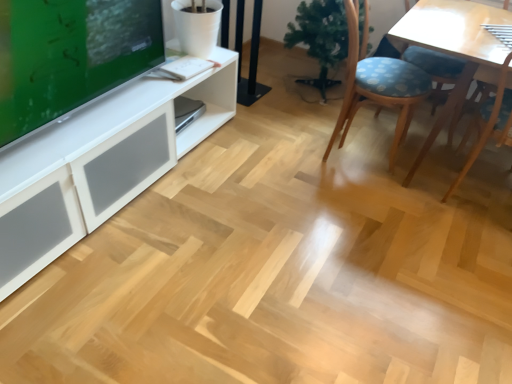
You are a GUI agent. You are given a task and a screenshot of the screen. Output one action in this format:
    pyautogui.click(x=<x>, y=<y>)
    Task: Click on the vacant region to the left of blue fabric chair at center-right
    Image resolution: width=512 pixels, height=384 pixels.
    Given the screenshot: What is the action you would take?
    pyautogui.click(x=284, y=144)